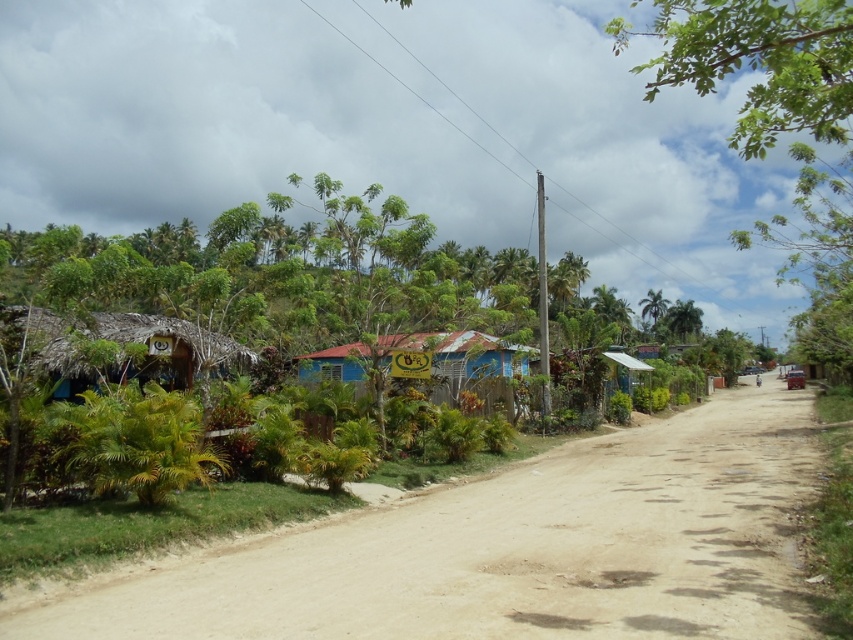
Who is shorter, thatched roof hut at left or blue corrugated metal hut at center?

With less height is thatched roof hut at left.

Does thatched roof hut at left have a smaller size compared to blue corrugated metal hut at center?

Yes.

The width and height of the screenshot is (853, 640). Find the location of `thatched roof hut at left`. thatched roof hut at left is located at coordinates (171, 346).

Which is behind, point (428, 544) or point (0, 317)?

Positioned behind is point (0, 317).

Who is more forward, (624, 604) or (160, 369)?

Point (624, 604) is more forward.

Between point (601, 561) and point (10, 308), which one is positioned in front?

Point (601, 561)

This screenshot has width=853, height=640. I want to click on brown sandy dirt track at center, so click(x=511, y=548).

Who is shorter, brown sandy dirt track at center or blue corrugated metal hut at center?

brown sandy dirt track at center

Can you confirm if brown sandy dirt track at center is shorter than blue corrugated metal hut at center?

Indeed, brown sandy dirt track at center has a lesser height compared to blue corrugated metal hut at center.

You are a GUI agent. You are given a task and a screenshot of the screen. Output one action in this format:
    pyautogui.click(x=<x>, y=<y>)
    Task: Click on the brown sandy dirt track at center
    The height and width of the screenshot is (640, 853).
    Given the screenshot: What is the action you would take?
    pyautogui.click(x=511, y=548)

Image resolution: width=853 pixels, height=640 pixels. I want to click on brown sandy dirt track at center, so click(511, 548).